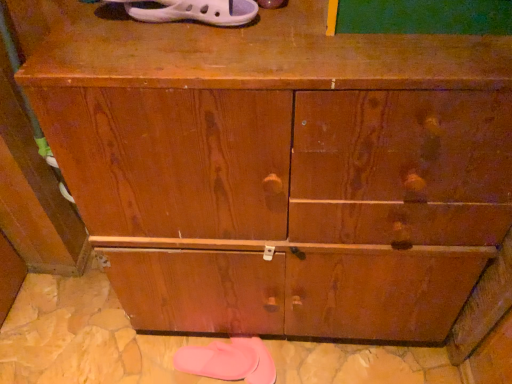
The width and height of the screenshot is (512, 384). In order to click on vacant area that lies to the right of white rubber sandal at upper center, arranged as the 1th footwear when viewed from the top in this screenshot , I will do point(291,27).